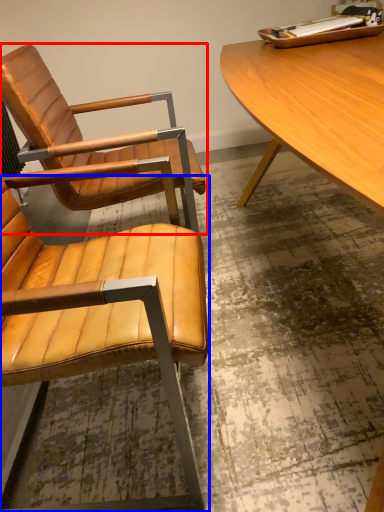
Question: Among these objects, which one is farthest to the camera, chair (highlighted by a red box) or chair (highlighted by a blue box)?

Choices:
 (A) chair
 (B) chair

Answer: (A)